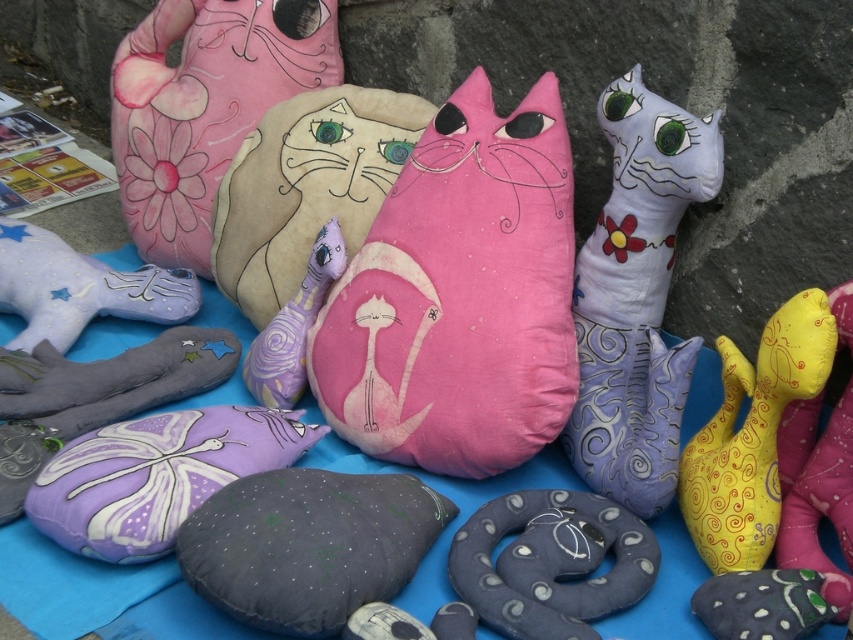
Who is more forward, (163, 276) or (335, 262)?

Positioned in front is point (335, 262).

Does point (22, 348) lie behind point (291, 356)?

Yes, it is.

Where is `purple fabric whale at left`? purple fabric whale at left is located at coordinates point(80,288).

Is matte pink fabric cat at center below yellow fabric cat at right?

Incorrect, matte pink fabric cat at center is not positioned below yellow fabric cat at right.

Does matte pink fabric cat at center have a lesser width compared to yellow fabric cat at right?

No, matte pink fabric cat at center is not thinner than yellow fabric cat at right.

Locate an element on the screen. matte pink fabric cat at center is located at coordinates (459, 296).

In the scene shown: Can you confirm if matte white cat at center is positioned to the right of matte gray snake at center?

Indeed, matte white cat at center is positioned on the right side of matte gray snake at center.

Identify the location of matte white cat at center. (636, 298).